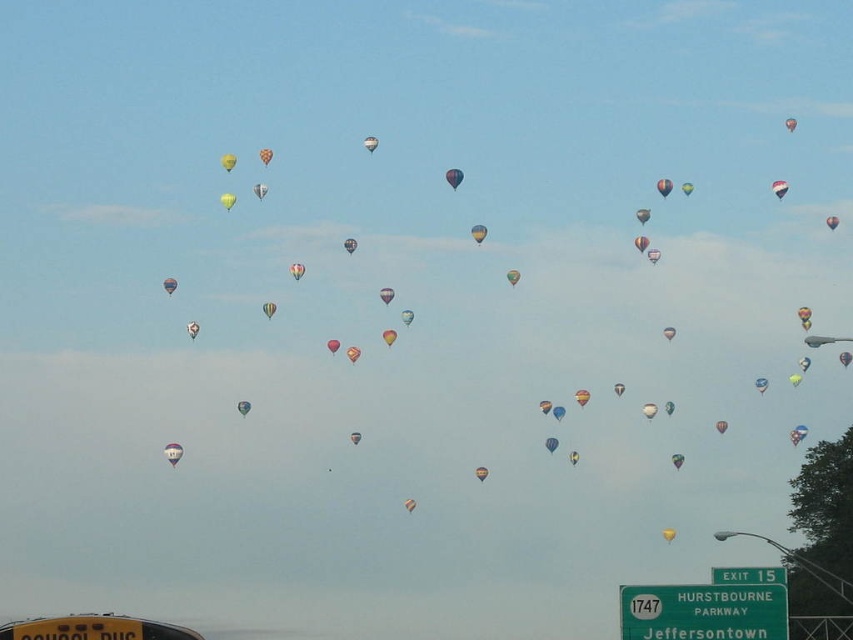
Question: Is matte blue balloon at center below yellow fabric balloon at upper center?

Choices:
 (A) no
 (B) yes

Answer: (B)

Question: Does matte blue balloon at center have a lesser width compared to yellow fabric balloon at upper center?

Choices:
 (A) yes
 (B) no

Answer: (A)

Question: Which point is farther from the camera taking this photo?

Choices:
 (A) (227, 161)
 (B) (450, 173)

Answer: (A)

Question: Can you confirm if matte blue balloon at center is smaller than yellow fabric balloon at upper center?

Choices:
 (A) yes
 (B) no

Answer: (A)